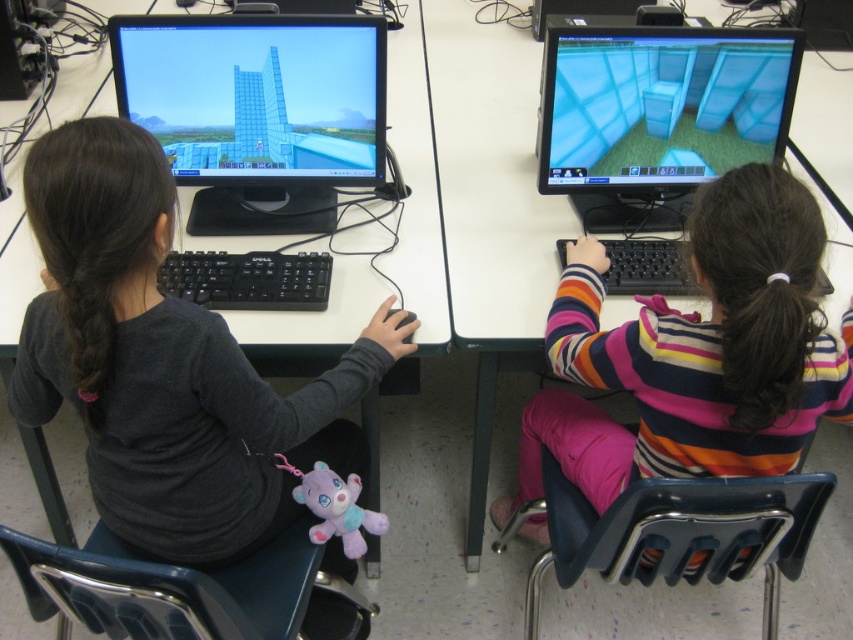
You are a teacher observing the classroom scene. You need to determine which object is taller between the striped sweater at right and the transparent glass monitor at upper left. Based on the scene description, which one is taller?

The striped sweater at right is taller than the transparent glass monitor at upper left according to the description.

The scene shows two children in a classroom setting. The striped sweater at right and transparent glass computer monitor at upper right are present. Which object is closer to the viewer?

The striped sweater at right is closer to the viewer because it is in front of the transparent glass computer monitor at upper right.

You are a teacher observing the two children in the classroom. You notice two points marked on the floor near their desks. The first point is at coordinate point(224, 540) and the second is at point(787, 230). From your vantage point at the front of the classroom, which point is closer to the back wall?

The point at coordinate point0.844, 0.264 is closer to the back wall because it is behind point(787, 230).